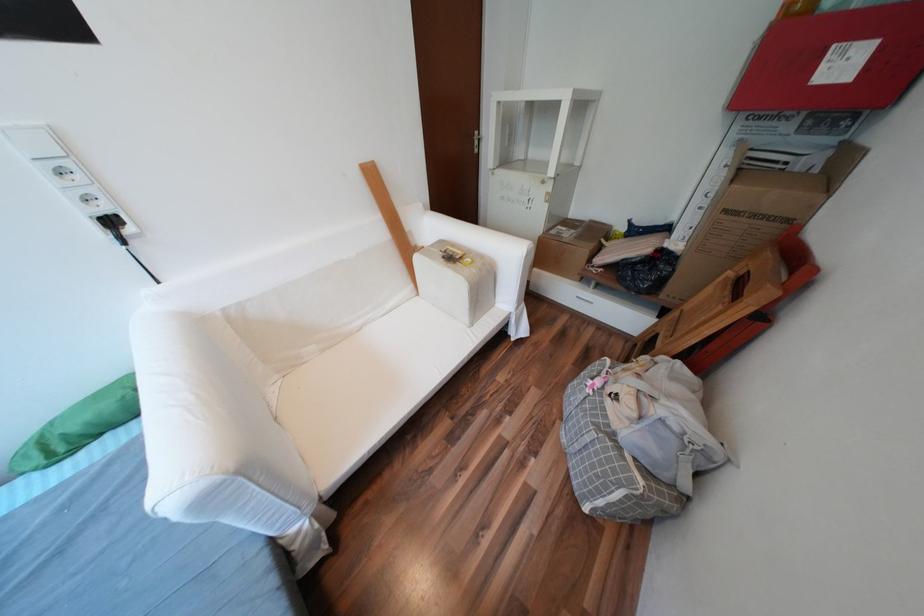
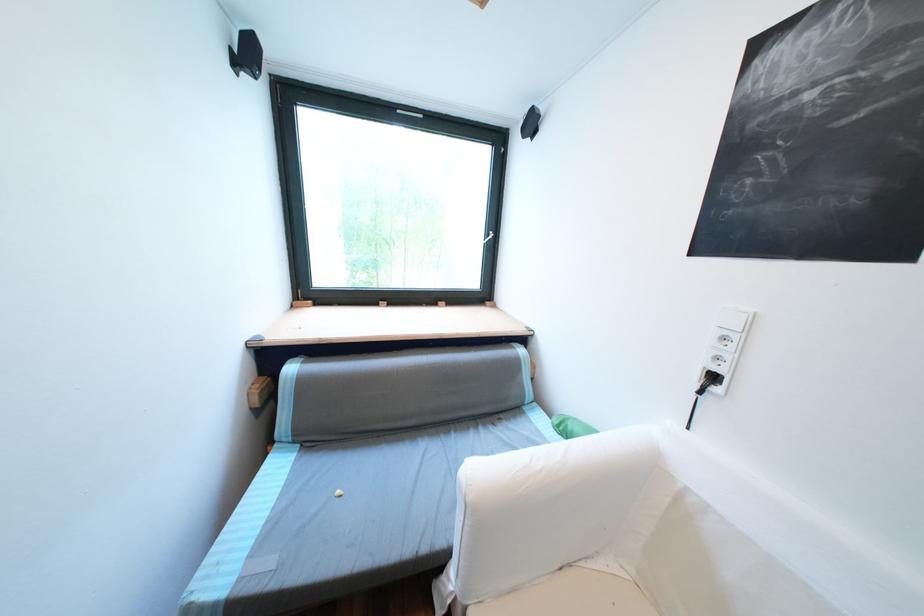
In the second image, find the point that corresponds to (x=120, y=222) in the first image.

(723, 378)